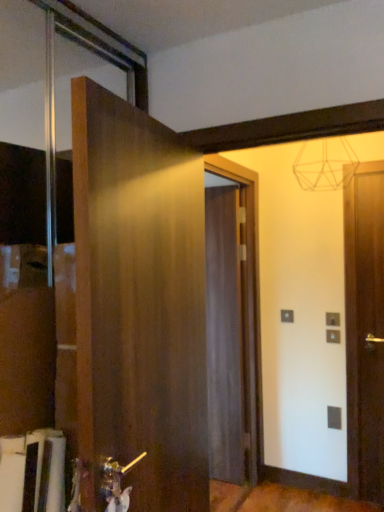
At what (x,y) coordinates should I click in order to perform the action: click on wooden door at left, positioned as the 1th door in front-to-back order. Please return your answer as a coordinate pair (x, y). This screenshot has height=512, width=384. Looking at the image, I should click on (140, 298).

The image size is (384, 512). Describe the element at coordinates (140, 298) in the screenshot. I see `wooden door at left, positioned as the 2th door in back-to-front order` at that location.

The image size is (384, 512). Find the location of `matte wood door at center, which is the 1th door in right-to-left order`. matte wood door at center, which is the 1th door in right-to-left order is located at coordinates (224, 335).

This screenshot has height=512, width=384. Describe the element at coordinates (224, 335) in the screenshot. I see `matte wood door at center, which is the 2th door from left to right` at that location.

What is the approximate width of matte wood door at center, the 2th door in the front-to-back sequence?

It is 5.43 inches.

This screenshot has height=512, width=384. Identify the location of wooden door at left, positioned as the 1th door in front-to-back order. (140, 298).

Between matte wood door at center, which ranks as the first door in back-to-front order, and wooden door at left, the 1th door when ordered from left to right, which one appears on the left side from the viewer's perspective?

wooden door at left, the 1th door when ordered from left to right, is more to the left.

Is matte wood door at center, which is the 1th door in right-to-left order, behind wooden door at left, positioned as the 1th door in front-to-back order?

Yes, it is behind wooden door at left, positioned as the 1th door in front-to-back order.

Considering the points (240, 389) and (84, 290), which point is in front, point (240, 389) or point (84, 290)?

Positioned in front is point (84, 290).

From the image's perspective, does matte wood door at center, which is the 2th door from left to right, appear lower than wooden door at left, positioned as the 1th door in front-to-back order?

Yes, from the image's perspective, matte wood door at center, which is the 2th door from left to right, is beneath wooden door at left, positioned as the 1th door in front-to-back order.

From a real-world perspective, is matte wood door at center, which is the 2th door from left to right, above or below wooden door at left, positioned as the 1th door in front-to-back order?

In terms of real-world spatial position, matte wood door at center, which is the 2th door from left to right, is below wooden door at left, positioned as the 1th door in front-to-back order.

Which of these two, matte wood door at center, the 2th door in the front-to-back sequence, or wooden door at left, the 1th door when ordered from left to right, is thinner?

matte wood door at center, the 2th door in the front-to-back sequence.

Is matte wood door at center, which is the 2th door from left to right, shorter than wooden door at left, the second door from the right?

In fact, matte wood door at center, which is the 2th door from left to right, may be taller than wooden door at left, the second door from the right.

Is matte wood door at center, which ranks as the first door in back-to-front order, bigger than wooden door at left, positioned as the 2th door in back-to-front order?

No.

Is matte wood door at center, which is the 2th door from left to right, located outside wooden door at left, the 1th door when ordered from left to right?

matte wood door at center, which is the 2th door from left to right, is positioned outside wooden door at left, the 1th door when ordered from left to right.

From the picture: Would you consider matte wood door at center, which is the 1th door in right-to-left order, to be distant from wooden door at left, positioned as the 1th door in front-to-back order?

Indeed, matte wood door at center, which is the 1th door in right-to-left order, is not near wooden door at left, positioned as the 1th door in front-to-back order.

Is matte wood door at center, the 2th door in the front-to-back sequence, aimed at wooden door at left, positioned as the 2th door in back-to-front order?

No, matte wood door at center, the 2th door in the front-to-back sequence, is not facing towards wooden door at left, positioned as the 2th door in back-to-front order.

The width and height of the screenshot is (384, 512). Identify the location of door that is above the matte wood door at center, which is the 2th door from left to right (from the image's perspective). (140, 298).

Based on their positions, is wooden door at left, positioned as the 1th door in front-to-back order, located to the left or right of matte wood door at center, which is the 1th door in right-to-left order?

Based on their positions, wooden door at left, positioned as the 1th door in front-to-back order, is located to the left of matte wood door at center, which is the 1th door in right-to-left order.

Is wooden door at left, positioned as the 2th door in back-to-front order, closer to camera compared to matte wood door at center, which is the 2th door from left to right?

Yes, it is.

Does point (173, 380) come behind point (210, 461)?

That is False.

From the image's perspective, would you say wooden door at left, positioned as the 1th door in front-to-back order, is positioned over matte wood door at center, which ranks as the first door in back-to-front order?

Yes, from the image's perspective, wooden door at left, positioned as the 1th door in front-to-back order, is above matte wood door at center, which ranks as the first door in back-to-front order.

From a real-world perspective, which object rests below the other?

matte wood door at center, the 2th door in the front-to-back sequence, from a real-world perspective.

In terms of width, does wooden door at left, the 1th door when ordered from left to right, look wider or thinner when compared to matte wood door at center, which is the 2th door from left to right?

In the image, wooden door at left, the 1th door when ordered from left to right, appears to be wider than matte wood door at center, which is the 2th door from left to right.

Considering the sizes of wooden door at left, the 1th door when ordered from left to right, and matte wood door at center, which is the 1th door in right-to-left order, in the image, is wooden door at left, the 1th door when ordered from left to right, taller or shorter than matte wood door at center, which is the 1th door in right-to-left order,?

wooden door at left, the 1th door when ordered from left to right, is shorter than matte wood door at center, which is the 1th door in right-to-left order.

Consider the image. Who is bigger, wooden door at left, the second door from the right, or matte wood door at center, which ranks as the first door in back-to-front order?

wooden door at left, the second door from the right, is bigger.

Is matte wood door at center, which is the 2th door from left to right, inside wooden door at left, positioned as the 1th door in front-to-back order?

No, matte wood door at center, which is the 2th door from left to right, is located outside of wooden door at left, positioned as the 1th door in front-to-back order.

Can you see wooden door at left, the second door from the right, touching matte wood door at center, which is the 1th door in right-to-left order?

wooden door at left, the second door from the right, and matte wood door at center, which is the 1th door in right-to-left order, are not in contact.

Is wooden door at left, positioned as the 1th door in front-to-back order, positioned with its back to matte wood door at center, which ranks as the first door in back-to-front order?

wooden door at left, positioned as the 1th door in front-to-back order, does not have its back to matte wood door at center, which ranks as the first door in back-to-front order.

How different are the orientations of wooden door at left, positioned as the 1th door in front-to-back order, and matte wood door at center, which is the 2th door from left to right, in degrees?

The angular difference between wooden door at left, positioned as the 1th door in front-to-back order, and matte wood door at center, which is the 2th door from left to right, is 95.6 degrees.

Identify the location of door located below the wooden door at left, positioned as the 1th door in front-to-back order (from the image's perspective). (224, 335).

Where is `door in front of the matte wood door at center, which is the 1th door in right-to-left order`? door in front of the matte wood door at center, which is the 1th door in right-to-left order is located at coordinates (140, 298).

I want to click on door below the wooden door at left, positioned as the 2th door in back-to-front order (from the image's perspective), so click(224, 335).